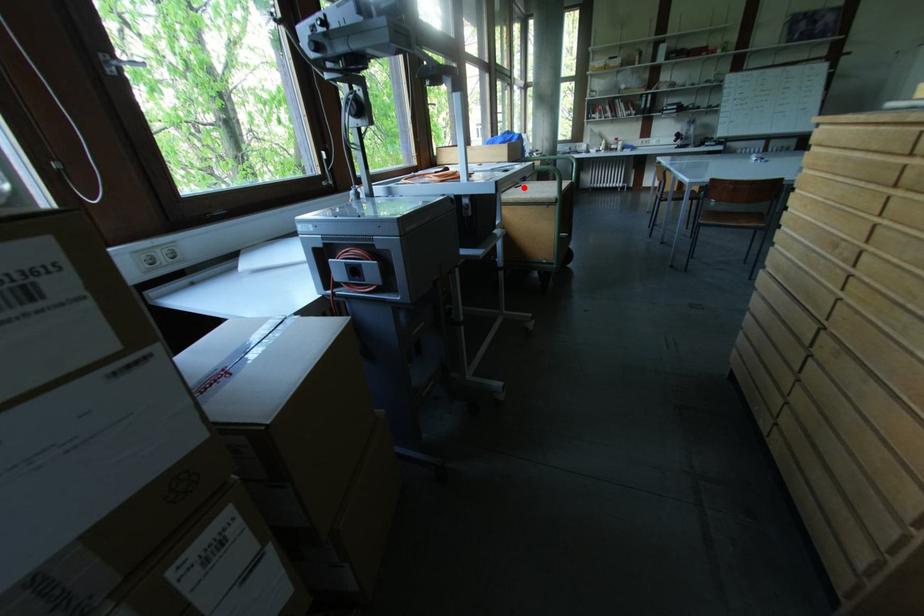
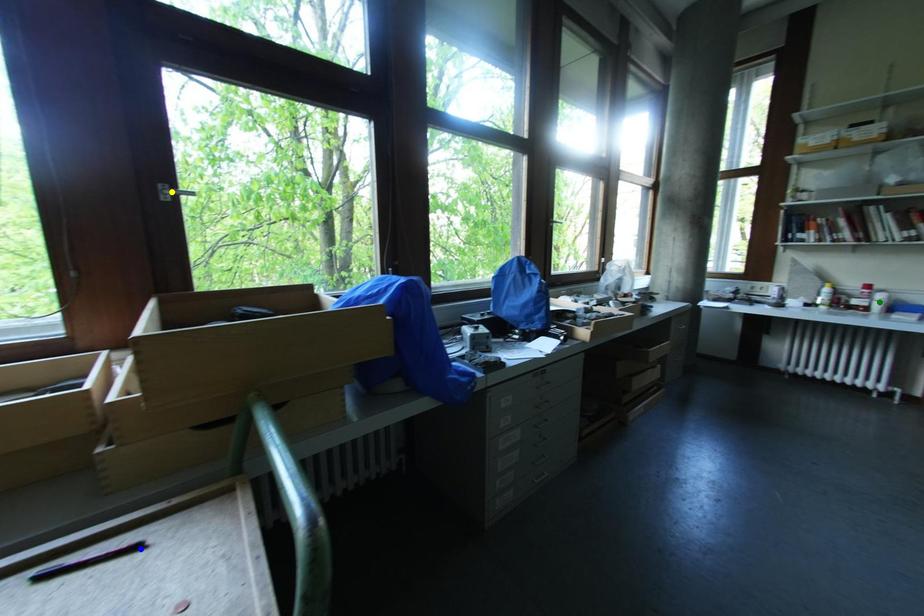
Question: I am providing you with two images of the same scene from different viewpoints. A red point is marked on the first image. You are given multiple points on the second image. Which mark in image 2 goes with the point in image 1?

Choices:
 (A) yellow point
 (B) green point
 (C) blue point

Answer: (C)